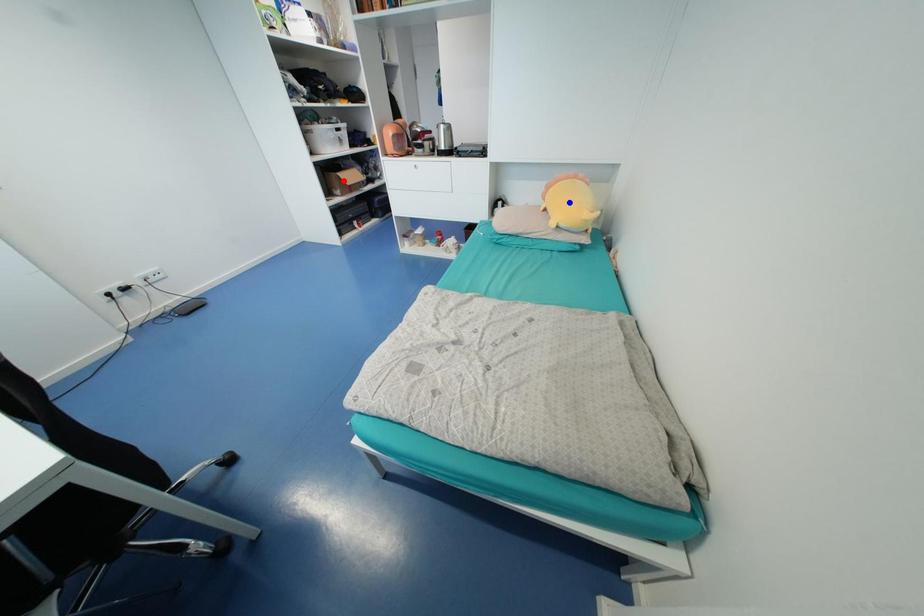
Question: In the image, two points are highlighted. Which point is nearer to the camera? Reply with the corresponding letter.

Choices:
 (A) blue point
 (B) red point

Answer: (A)